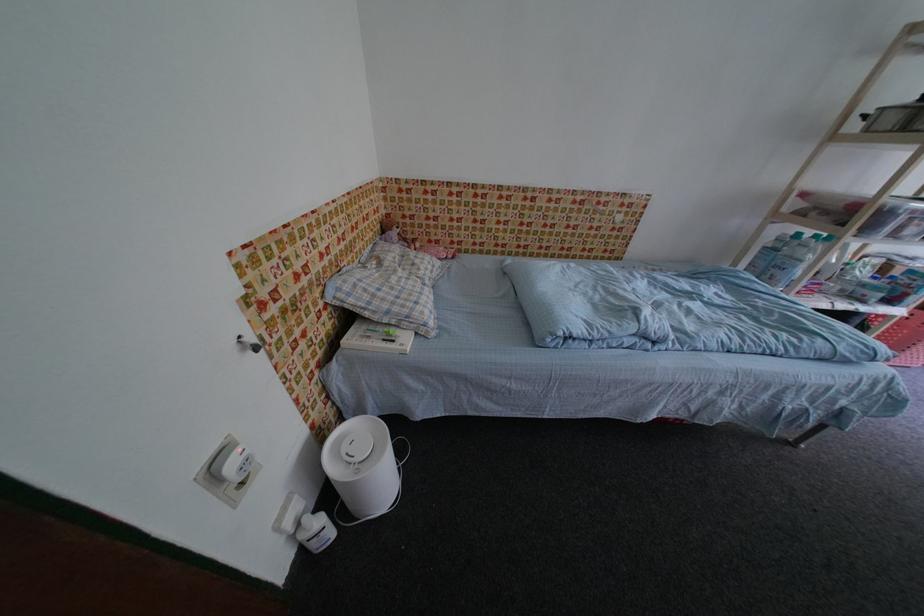
Describe the element at coordinates (787, 264) in the screenshot. Image resolution: width=924 pixels, height=616 pixels. I see `the blue bottle` at that location.